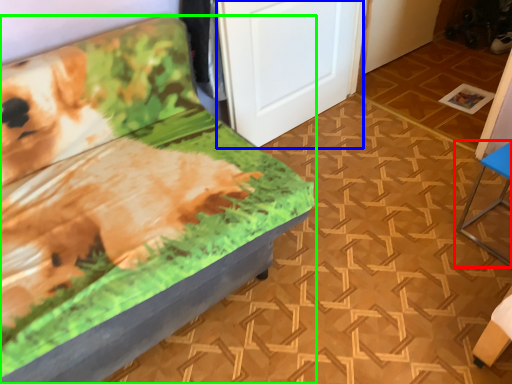
Question: Which is farther away from furniture (highlighted by a red box)? door (highlighted by a blue box) or furniture (highlighted by a green box)?

Choices:
 (A) door
 (B) furniture

Answer: (B)